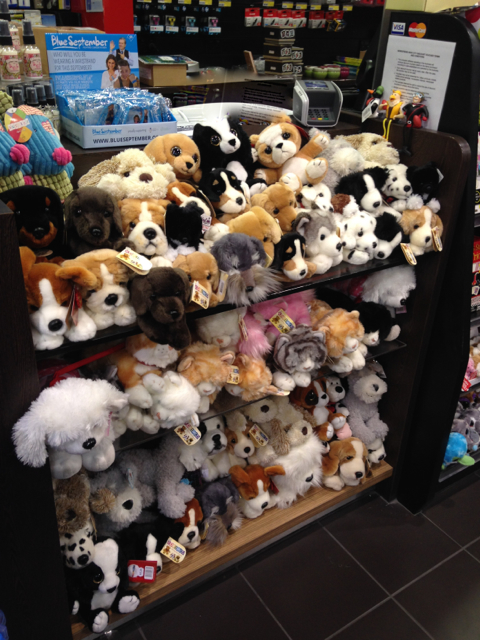
Identify the location of wall. The image size is (480, 640). (414, 4).